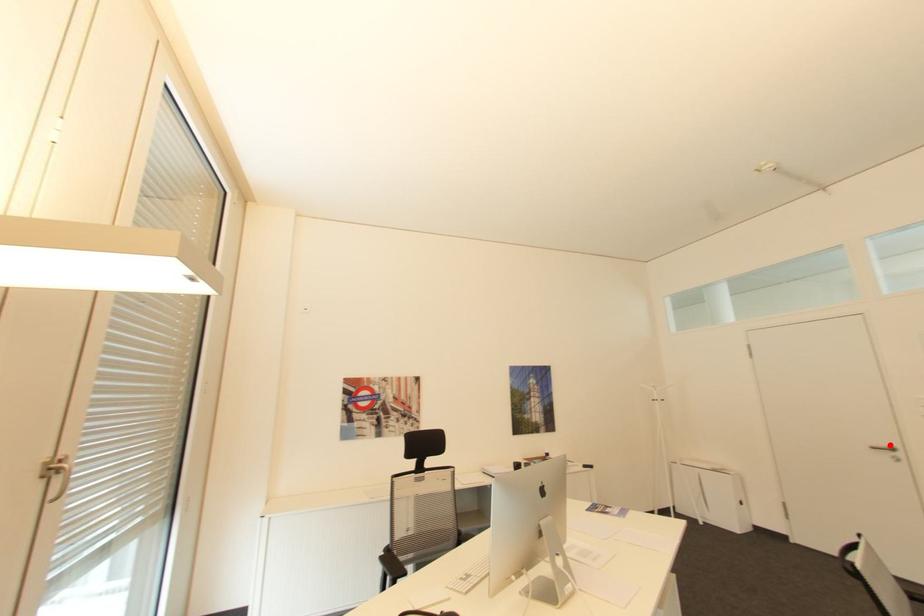
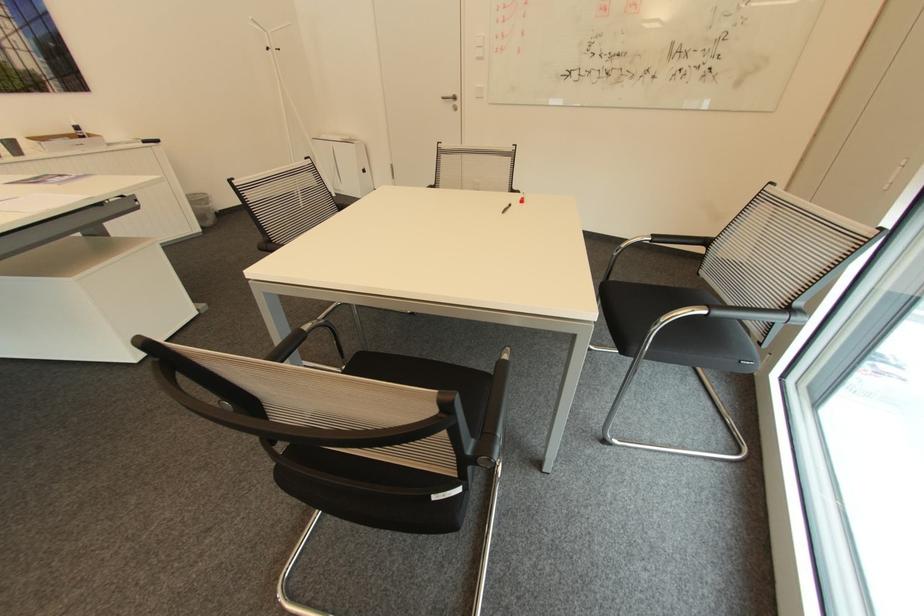
Where in the second image is the point corresponding to the highlighted location from the first image?

(456, 95)